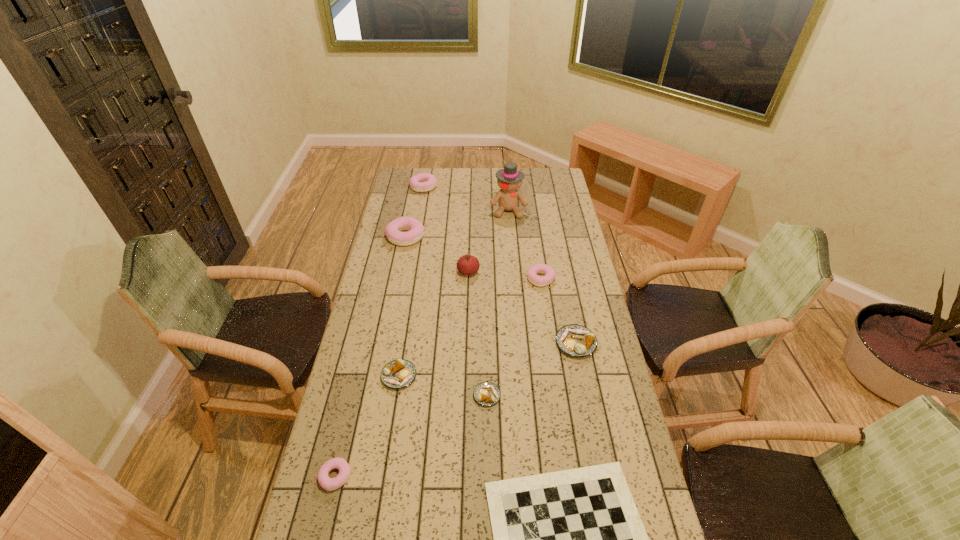
At what (x,y) coordinates should I click in order to perform the action: click on pastry object that ranks as the fifth closest to the smallest pink pastry. Please return your answer as a coordinate pair (x, y). The image size is (960, 540). Looking at the image, I should click on (393, 230).

The width and height of the screenshot is (960, 540). Identify the location of pastry that stands as the closest to the tallest pastry. click(423, 182).

This screenshot has width=960, height=540. I want to click on pink pastry that can be found as the second closest to the second farthest object, so click(393, 230).

I want to click on the closest pink pastry to the nearest pastry, so click(532, 272).

You are a GUI agent. You are given a task and a screenshot of the screen. Output one action in this format:
    pyautogui.click(x=<x>, y=<y>)
    Task: Click on the brown pastry that stands as the third closest to the tallest pastry
    
    Given the screenshot: What is the action you would take?
    pyautogui.click(x=486, y=393)

The image size is (960, 540). In order to click on brown pastry that is the third closest to the ninth shortest object in this screenshot , I will do `click(486, 393)`.